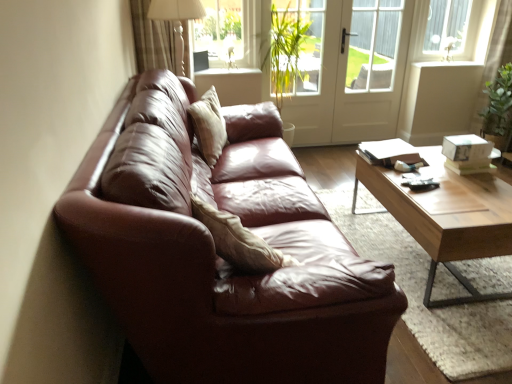
Identify the location of empty space that is ontop of white plastic window frame at upper right (from a real-world perspective). The width and height of the screenshot is (512, 384). tap(461, 1).